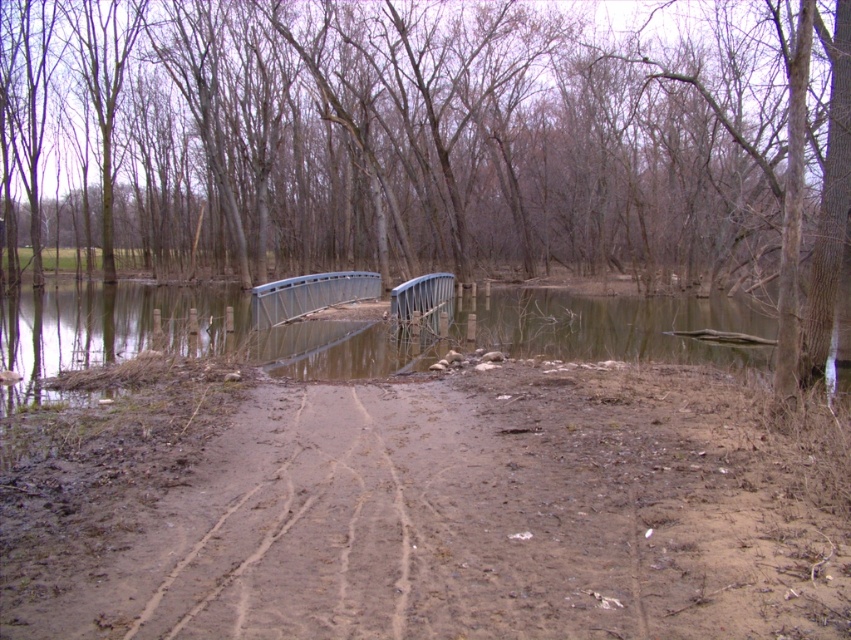
You are driving a car with a 2.5 meter height and need to cross the flooded area. The brown muddy dirt track at center and the metallic gray bridge at center are your options. Which path is safer to take considering the water level and structural integrity?

The brown muddy dirt track at center is safer because it is in front of the metallic gray bridge at center, which is damaged and leaning, making it unsafe for crossing.

You are a drone operator trying to capture a clear aerial view of the flooded area. You notice two points of interest marked as point (x=372, y=208) and point (x=260, y=305). Which point is closer to your drone camera?

Point (x=372, y=208) is further to the camera than point (x=260, y=305), so the point closer to the drone camera is point (x=260, y=305).

A hiker wants to cross the flooded area using the metallic gray bridge at center but is concerned about the distance to the brown wood tree at center. Is the bridge close enough to the tree to safely reach it without getting soaked?

The distance between the brown wood tree at center and the metallic gray bridge at center is 16.38 meters. Since the bridge is submerged and the water is deep, the hiker would need to wade through 16.38 meters of water to reach the tree, which is unsafe and not advisable.